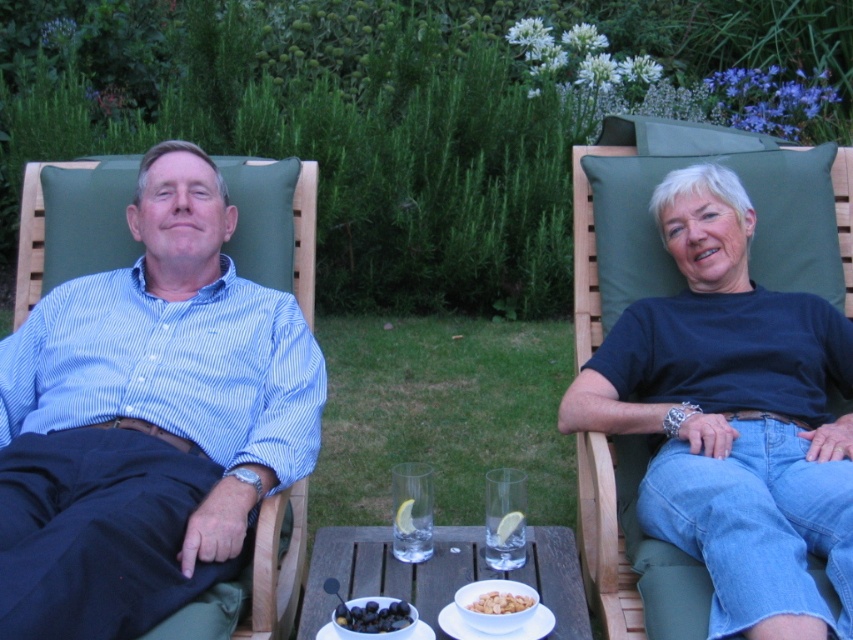
You are a photographer trying to capture both the blue striped shirt at left and the smooth beige nuts at lower center in a single shot. Considering their sizes, which object should you focus on first to ensure both are clearly visible in the frame?

The blue striped shirt at left is larger in size than the smooth beige nuts at lower center, so you should focus on the blue striped shirt at left first to ensure both are clearly visible in the frame.

You are a photographer setting up a shoot in the scene described. You need to ensure that the blue striped shirt at left and the smooth beige nuts at lower center are both visible in the frame. Considering their sizes, which object should you prioritize framing closer to the camera to maintain detail?

The blue striped shirt at left is larger in width than the smooth beige nuts at lower center, so you should prioritize framing the blue striped shirt at left closer to the camera to maintain detail.